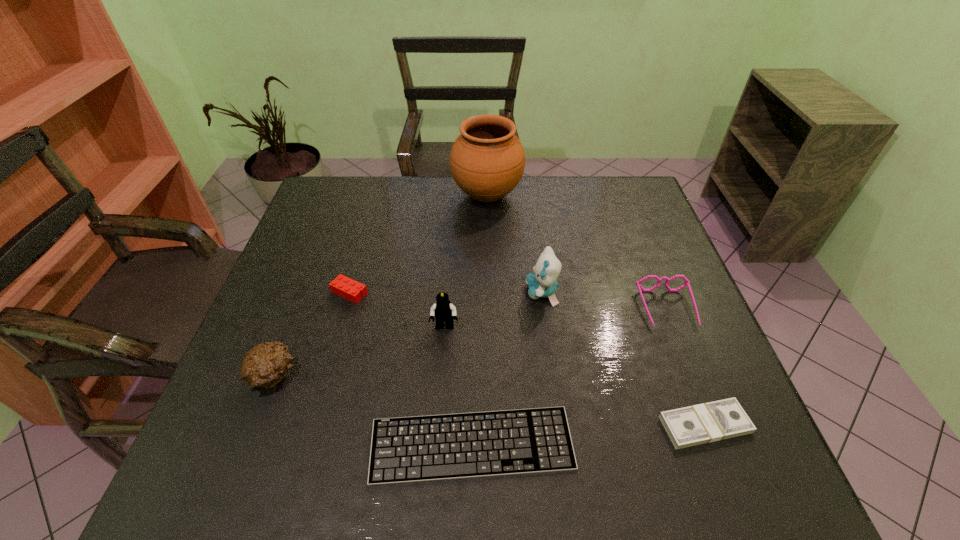
I want to click on vacant space at the far edge of the desktop, so click(388, 192).

Where is `vacant space at the near edge`? This screenshot has width=960, height=540. vacant space at the near edge is located at coordinates (364, 479).

The width and height of the screenshot is (960, 540). I want to click on free location at the left edge of the desktop, so click(x=292, y=264).

Locate an element on the screen. This screenshot has width=960, height=540. vacant area at the right edge of the desktop is located at coordinates (746, 436).

You are a GUI agent. You are given a task and a screenshot of the screen. Output one action in this format:
    pyautogui.click(x=<x>, y=<y>)
    Task: Click on the vacant space at the far left corner of the desktop
    
    Given the screenshot: What is the action you would take?
    pyautogui.click(x=363, y=192)

In the image, there is a desktop. At what (x,y) coordinates should I click in order to perform the action: click on free region at the far right corner. Please return your answer as a coordinate pair (x, y). Looking at the image, I should click on (607, 212).

Locate an element on the screen. This screenshot has width=960, height=540. free space between the farthest object and the shorter Lego is located at coordinates (419, 244).

Image resolution: width=960 pixels, height=540 pixels. Identify the location of empty space that is in between the nearer Lego and the farthest object. (466, 261).

Identify the location of free space between the nearer Lego and the fourth shortest object. The height and width of the screenshot is (540, 960). (556, 318).

In order to click on empty space between the pottery and the spectacles in this screenshot , I will do `click(577, 252)`.